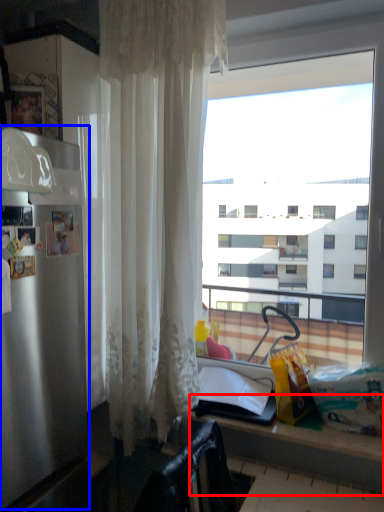
Question: Which object appears closest to the camera in this image, counter (highlighted by a red box) or appliance (highlighted by a blue box)?

Choices:
 (A) counter
 (B) appliance

Answer: (A)